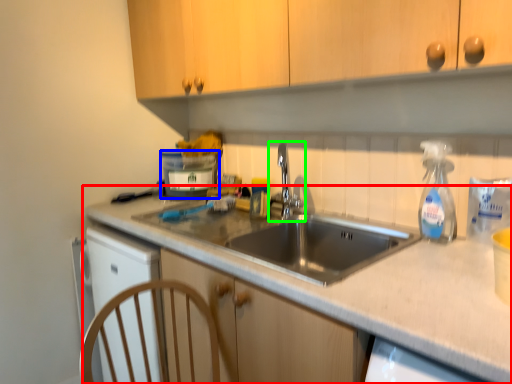
Question: Estimate the real-world distances between objects in this image. Which object is closer to countertop (highlighted by a red box), appliance (highlighted by a blue box) or tap (highlighted by a green box)?

Choices:
 (A) appliance
 (B) tap

Answer: (B)